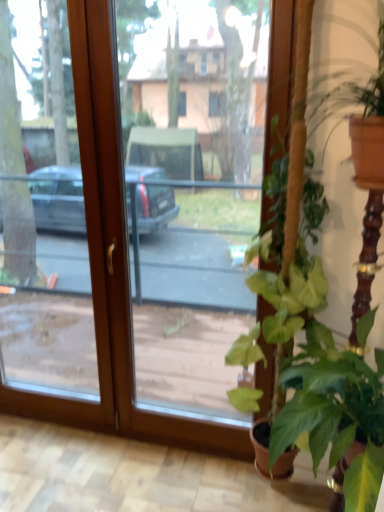
Question: Is transparent glass door at center shorter than green leafy plant at right, which is the 3th houseplant from bottom to top?

Choices:
 (A) yes
 (B) no

Answer: (B)

Question: Is transparent glass door at center at the right side of green leafy plant at right, which is the 3th houseplant from bottom to top?

Choices:
 (A) yes
 (B) no

Answer: (B)

Question: Is green leafy plant at right, which is the 3th houseplant from bottom to top, at the back of transparent glass door at center?

Choices:
 (A) no
 (B) yes

Answer: (A)

Question: Is transparent glass door at center not close to green leafy plant at right, acting as the first houseplant starting from the top?

Choices:
 (A) yes
 (B) no

Answer: (A)

Question: Does transparent glass door at center have a greater height compared to green leafy plant at right, which is the 3th houseplant from bottom to top?

Choices:
 (A) yes
 (B) no

Answer: (A)

Question: Is transparent glass door at center bigger than green leafy plant at right, which is the 3th houseplant from bottom to top?

Choices:
 (A) yes
 (B) no

Answer: (A)

Question: From a real-world perspective, is green matte plant at right, which appears as the second houseplant when viewed from the top, on green leafy plant at lower right, marked as the third houseplant in a top-to-bottom arrangement?

Choices:
 (A) no
 (B) yes

Answer: (A)

Question: Considering the relative positions of green matte plant at right, which appears as the second houseplant when viewed from the top, and green leafy plant at lower right, marked as the third houseplant in a top-to-bottom arrangement, in the image provided, is green matte plant at right, which appears as the second houseplant when viewed from the top, behind green leafy plant at lower right, marked as the third houseplant in a top-to-bottom arrangement,?

Choices:
 (A) yes
 (B) no

Answer: (A)

Question: Is there a large distance between green matte plant at right, arranged as the second houseplant when ordered from the bottom, and green leafy plant at lower right, which is the first houseplant in bottom-to-top order?

Choices:
 (A) no
 (B) yes

Answer: (A)

Question: Is green matte plant at right, arranged as the second houseplant when ordered from the bottom, located outside green leafy plant at lower right, which is the first houseplant in bottom-to-top order?

Choices:
 (A) no
 (B) yes

Answer: (B)

Question: Does green matte plant at right, arranged as the second houseplant when ordered from the bottom, appear on the right side of green leafy plant at lower right, marked as the third houseplant in a top-to-bottom arrangement?

Choices:
 (A) yes
 (B) no

Answer: (B)

Question: Considering the relative sizes of green matte plant at right, which appears as the second houseplant when viewed from the top, and green leafy plant at lower right, which is the first houseplant in bottom-to-top order, in the image provided, is green matte plant at right, which appears as the second houseplant when viewed from the top, thinner than green leafy plant at lower right, which is the first houseplant in bottom-to-top order,?

Choices:
 (A) yes
 (B) no

Answer: (A)

Question: Does green leafy plant at lower right, marked as the third houseplant in a top-to-bottom arrangement, come in front of green leafy plant at right, which is the 3th houseplant from bottom to top?

Choices:
 (A) yes
 (B) no

Answer: (A)